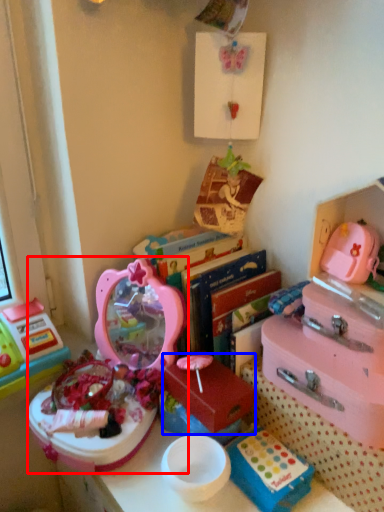
Question: Which object is closer to the camera taking this photo, toy (highlighted by a red box) or storage box (highlighted by a blue box)?

Choices:
 (A) toy
 (B) storage box

Answer: (A)